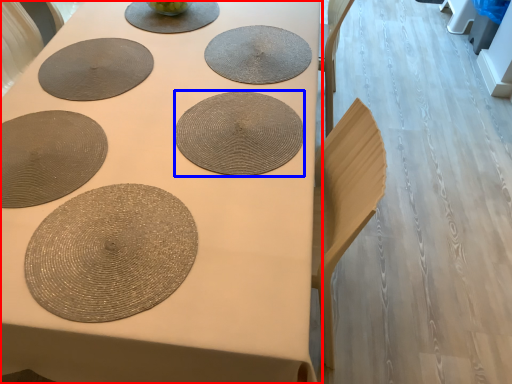
Question: Which point is closer to the camera, table (highlighted by a red box) or coaster (highlighted by a blue box)?

Choices:
 (A) table
 (B) coaster

Answer: (A)